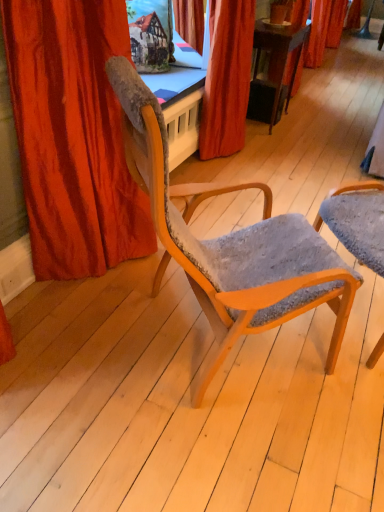
Question: From a real-world perspective, is textured gray fabric chair at center, marked as the first chair in a right-to-left arrangement, positioned above or below velvet red curtain at center, the second curtain in the left-to-right sequence?

Choices:
 (A) above
 (B) below

Answer: (B)

Question: Is textured gray fabric chair at center, positioned as the second chair in left-to-right order, inside the boundaries of velvet red curtain at center, which is the 2th curtain in front-to-back order, or outside?

Choices:
 (A) outside
 (B) inside

Answer: (A)

Question: Estimate the real-world distances between objects in this image. Which object is farther from the textured gray fabric chair at center, positioned as the second chair in left-to-right order?

Choices:
 (A) velvet red curtain at center, which is the 1th curtain from right to left
 (B) wooden chair with textured fabric at center, arranged as the 2th chair when viewed from the right
 (C) velvet orange curtain at left, the second curtain when ordered from back to front

Answer: (A)

Question: Estimate the real-world distances between objects in this image. Which object is farther from the wooden chair with textured fabric at center, the 1th chair in the left-to-right sequence?

Choices:
 (A) velvet red curtain at center, which is the 1th curtain from right to left
 (B) textured gray fabric chair at center, positioned as the second chair in left-to-right order
 (C) velvet orange curtain at left, acting as the 2th curtain starting from the right

Answer: (A)